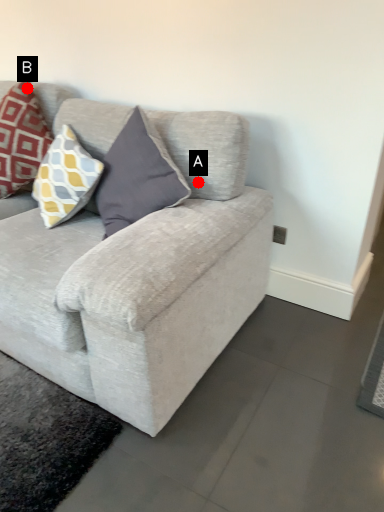
Question: Two points are circled on the image, labeled by A and B beside each circle. Which point appears farthest from the camera in this image?

Choices:
 (A) A is further
 (B) B is further

Answer: (B)